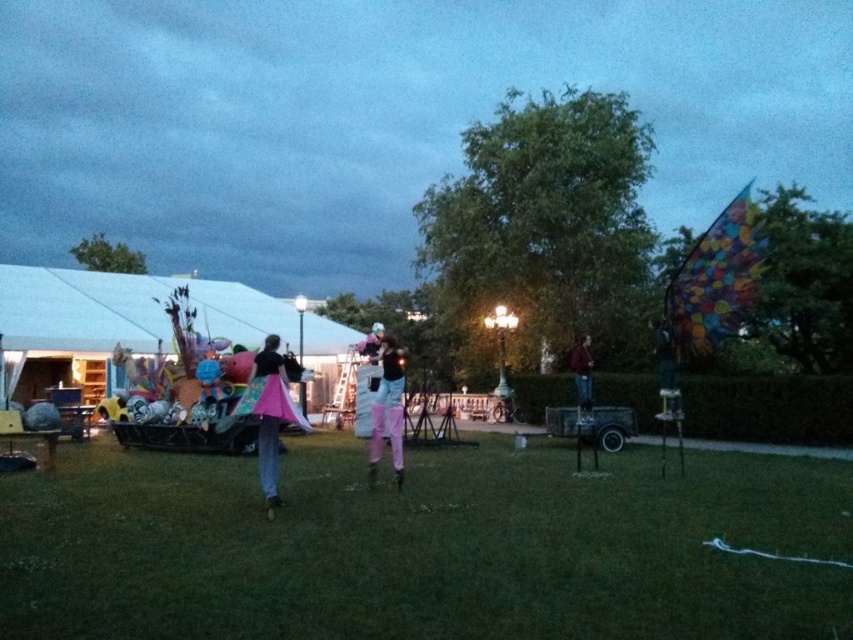
Between multicolored fabric kite at upper right and pink fabric kite at center, which one is positioned higher?

multicolored fabric kite at upper right

Is multicolored fabric kite at upper right taller than pink fabric kite at center?

Yes.

Is point (677, 288) positioned behind point (273, 385)?

Yes, point (677, 288) is farther from viewer.

At what (x,y) coordinates should I click in order to perform the action: click on multicolored fabric kite at upper right. Please return your answer as a coordinate pair (x, y). The image size is (853, 640). Looking at the image, I should click on (717, 280).

Can you confirm if green grass at center is positioned to the right of metallic silver helmet at center?

Incorrect, green grass at center is not on the right side of metallic silver helmet at center.

Does green grass at center have a larger size compared to metallic silver helmet at center?

Yes, green grass at center is bigger than metallic silver helmet at center.

The image size is (853, 640). Describe the element at coordinates (425, 547) in the screenshot. I see `green grass at center` at that location.

The height and width of the screenshot is (640, 853). I want to click on green grass at center, so click(425, 547).

Can you confirm if pink fabric kite at center is positioned to the left of dark blue jeans at center?

Yes, pink fabric kite at center is to the left of dark blue jeans at center.

At what (x,y) coordinates should I click in order to perform the action: click on pink fabric kite at center. Please return your answer as a coordinate pair (x, y). The image size is (853, 640). Looking at the image, I should click on (270, 413).

The height and width of the screenshot is (640, 853). Find the location of `pink fabric kite at center`. pink fabric kite at center is located at coordinates (270, 413).